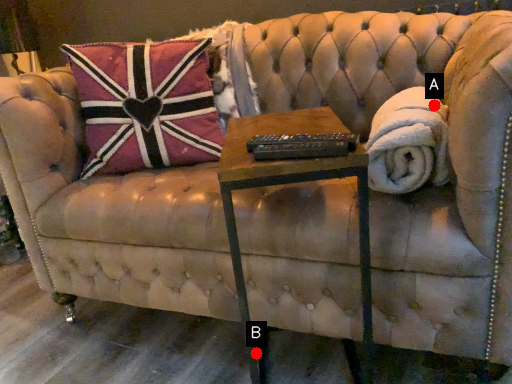
Question: Two points are circled on the image, labeled by A and B beside each circle. Which point appears closest to the camera in this image?

Choices:
 (A) A is closer
 (B) B is closer

Answer: (A)